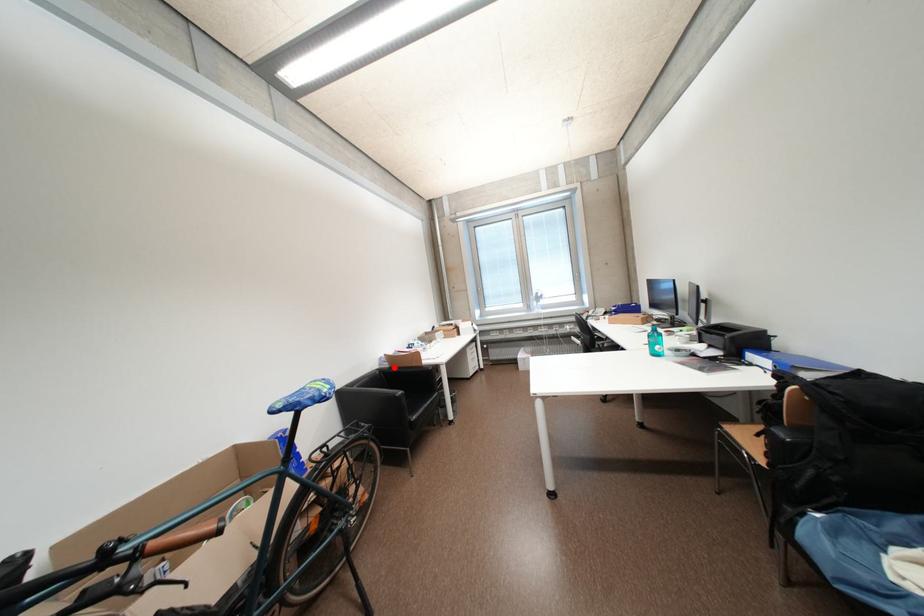
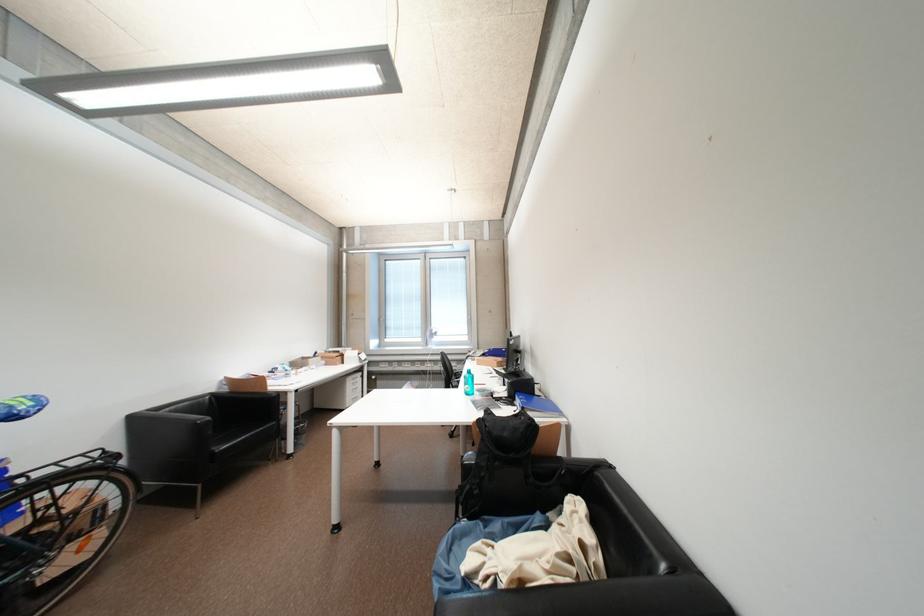
Find the pixel in the second image that matches the highlighted location in the first image.

(234, 391)